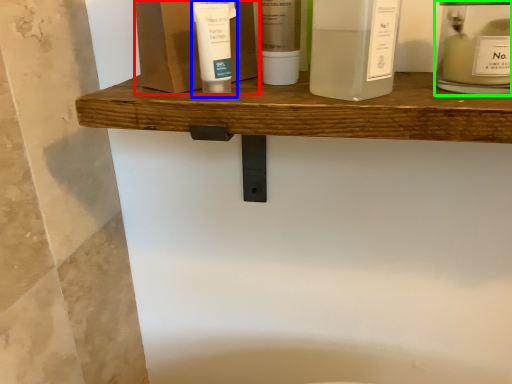
Question: Considering the real-world distances, which object is farthest from product (highlighted by a red box)? toiletry (highlighted by a blue box) or toiletry (highlighted by a green box)?

Choices:
 (A) toiletry
 (B) toiletry

Answer: (B)